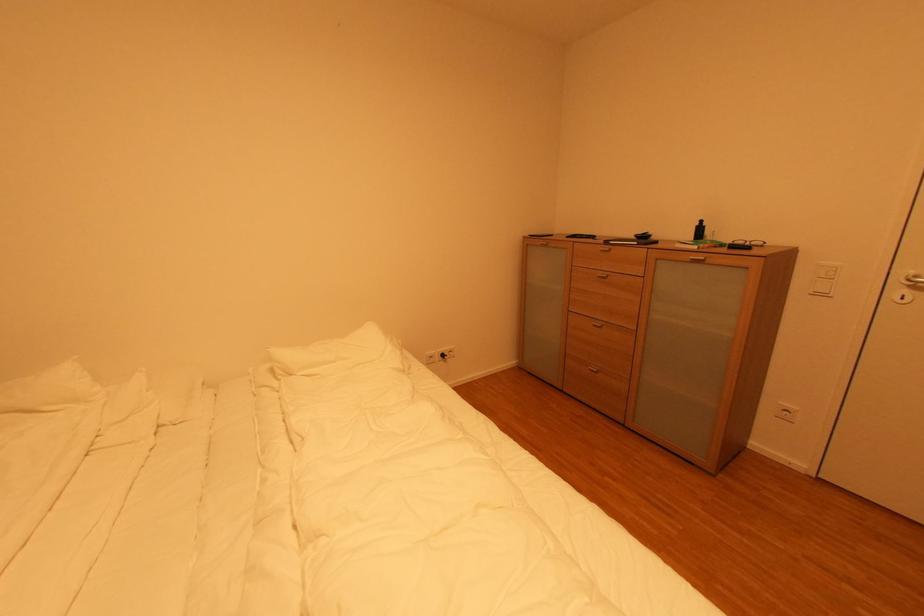
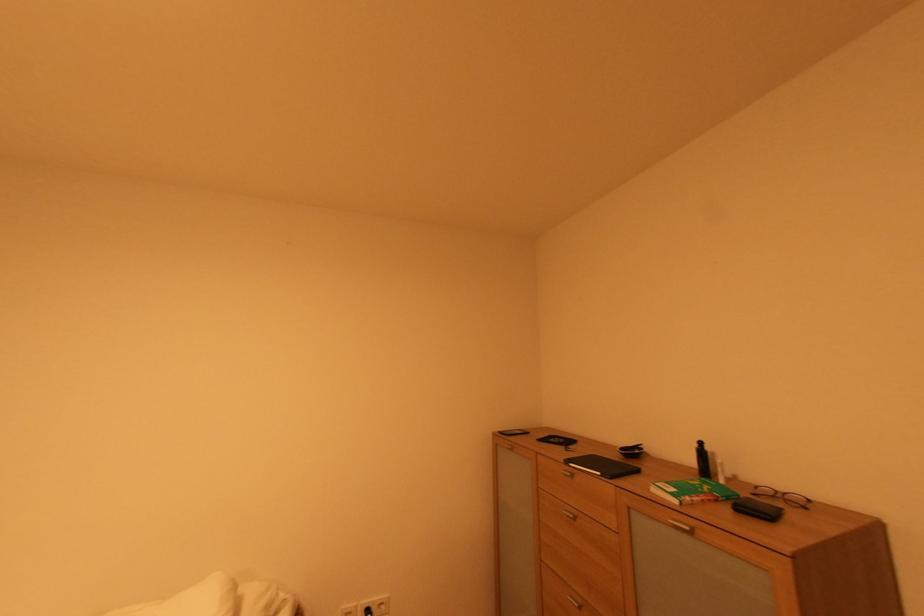
The point at (x=702, y=225) is marked in the first image. Where is the corresponding point in the second image?

(701, 447)